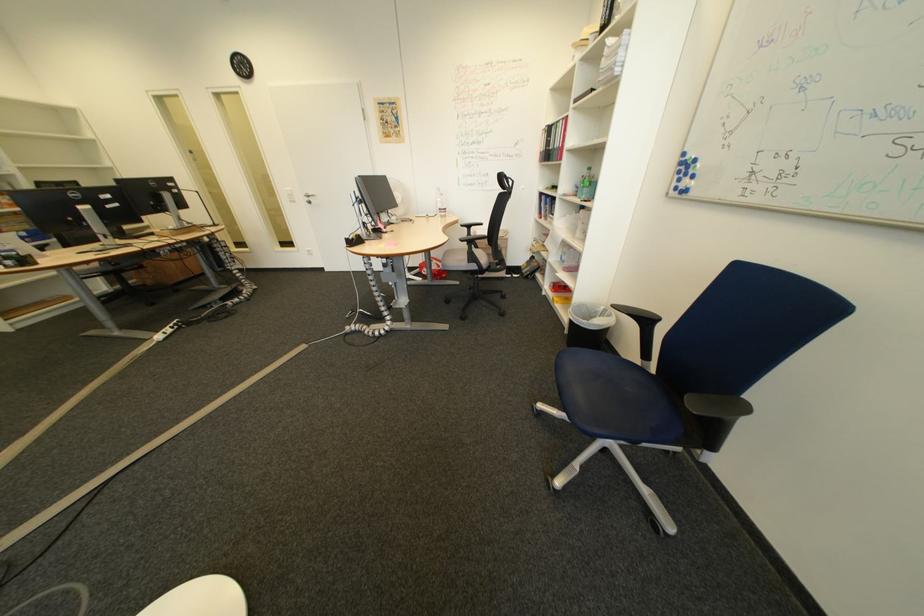
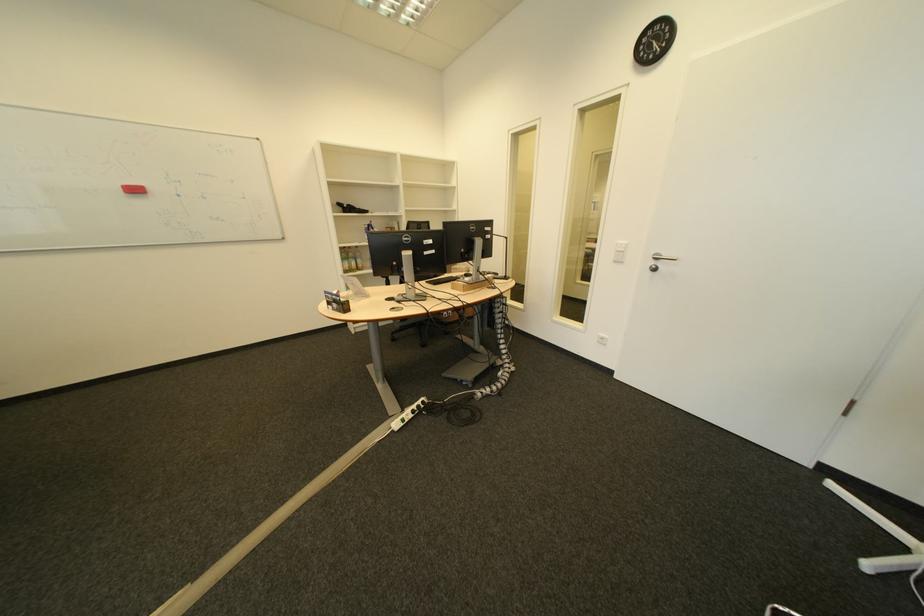
In the second image, find the point that corresponds to point (322, 198) in the first image.

(669, 260)